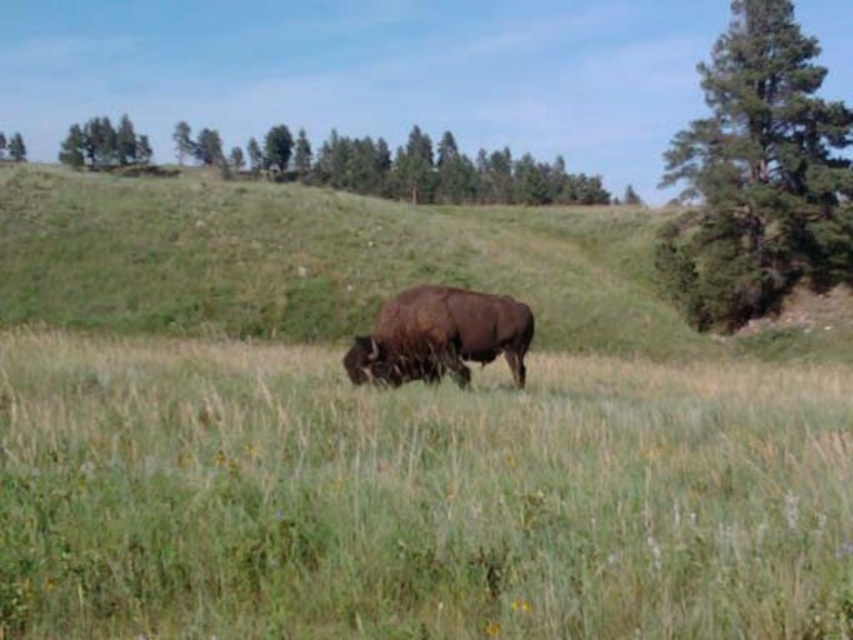
Can you confirm if green textured tree at upper right is bigger than brown furry buffalo at center?

Correct, green textured tree at upper right is larger in size than brown furry buffalo at center.

Which of these two, green textured tree at upper right or brown furry buffalo at center, stands shorter?

brown furry buffalo at center is shorter.

Image resolution: width=853 pixels, height=640 pixels. Identify the location of green textured tree at upper right. (758, 173).

Is brown furry buffalo at center to the right of green leafy tree at upper left from the viewer's perspective?

Correct, you'll find brown furry buffalo at center to the right of green leafy tree at upper left.

Consider the image. Which of these two, brown furry buffalo at center or green leafy tree at upper left, stands shorter?

brown furry buffalo at center

Who is more forward, [399,323] or [94,168]?

Positioned in front is point [399,323].

Identify the location of brown furry buffalo at center. This screenshot has width=853, height=640. (440, 337).

Which of these two, green textured tree at upper right or green leafy tree at upper left, stands taller?

With more height is green leafy tree at upper left.

Does point (704, 244) lie in front of point (113, 140)?

Yes, point (704, 244) is in front of point (113, 140).

Does point (722, 275) lie behind point (129, 160)?

No, it is in front of (129, 160).

At what (x,y) coordinates should I click in order to perform the action: click on green textured tree at upper right. Please return your answer as a coordinate pair (x, y). The image size is (853, 640). Looking at the image, I should click on (758, 173).